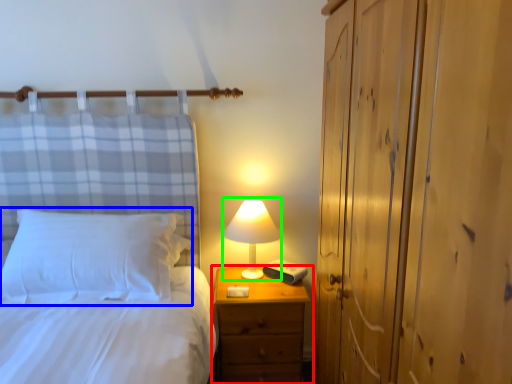
Question: Based on their relative distances, which object is nearer to nightstand (highlighted by a red box)? Choose from pillow (highlighted by a blue box) and table lamp (highlighted by a green box).

Choices:
 (A) pillow
 (B) table lamp

Answer: (B)